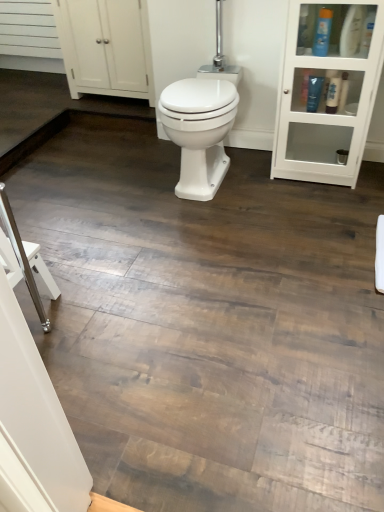
The width and height of the screenshot is (384, 512). Identify the location of vacant space to the left of white glossy bidet at center. (137, 183).